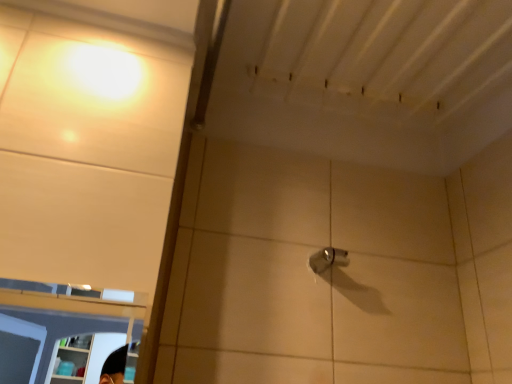
The image size is (512, 384). What are the coordinates of `satin nickel showerhead at center` in the screenshot? It's located at (327, 259).

This screenshot has height=384, width=512. Describe the element at coordinates (327, 259) in the screenshot. I see `satin nickel showerhead at center` at that location.

In order to face satin nickel showerhead at center, should I rotate leftwards or rightwards?

Rotate right and turn 10.314 degrees.

In order to click on satin nickel showerhead at center in this screenshot , I will do `click(327, 259)`.